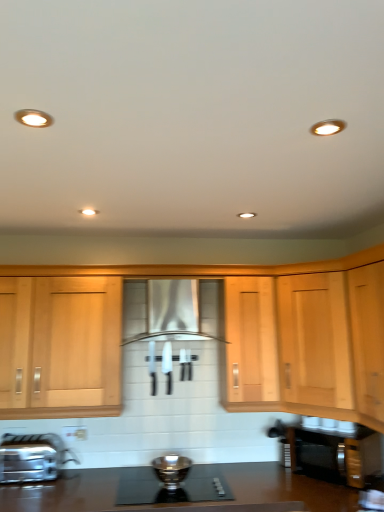
Question: Is black glass gas stove at center further to camera compared to satin silver bowl at center?

Choices:
 (A) no
 (B) yes

Answer: (A)

Question: Considering the relative sizes of black glass gas stove at center and satin silver bowl at center in the image provided, is black glass gas stove at center shorter than satin silver bowl at center?

Choices:
 (A) yes
 (B) no

Answer: (A)

Question: Is satin silver bowl at center at the back of black glass gas stove at center?

Choices:
 (A) no
 (B) yes

Answer: (A)

Question: Does black glass gas stove at center appear on the right side of satin silver bowl at center?

Choices:
 (A) yes
 (B) no

Answer: (A)

Question: From a real-world perspective, does black glass gas stove at center sit lower than satin silver bowl at center?

Choices:
 (A) no
 (B) yes

Answer: (B)

Question: From the image's perspective, is black glass gas stove at center located beneath satin silver bowl at center?

Choices:
 (A) yes
 (B) no

Answer: (A)

Question: Does white plastic electric outlet at lower center contain satin nickel faucet at lower left?

Choices:
 (A) no
 (B) yes

Answer: (A)

Question: Is white plastic electric outlet at lower center positioned far away from satin nickel faucet at lower left?

Choices:
 (A) no
 (B) yes

Answer: (A)

Question: Is white plastic electric outlet at lower center bigger than satin nickel faucet at lower left?

Choices:
 (A) yes
 (B) no

Answer: (B)

Question: Can you confirm if white plastic electric outlet at lower center is shorter than satin nickel faucet at lower left?

Choices:
 (A) yes
 (B) no

Answer: (A)

Question: Can you confirm if white plastic electric outlet at lower center is positioned to the left of satin nickel faucet at lower left?

Choices:
 (A) yes
 (B) no

Answer: (B)

Question: Is white plastic electric outlet at lower center thinner than satin nickel faucet at lower left?

Choices:
 (A) yes
 (B) no

Answer: (A)

Question: Is satin silver bowl at center facing towards satin nickel faucet at lower left?

Choices:
 (A) yes
 (B) no

Answer: (B)